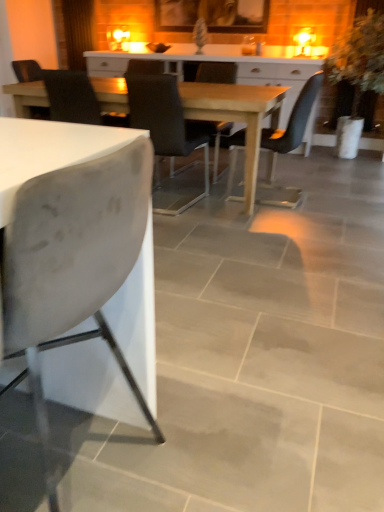
Question: Can you confirm if green leafy plant at right is thinner than white matte chair at left, which ranks as the 5th chair in back-to-front order?

Choices:
 (A) no
 (B) yes

Answer: (A)

Question: Is green leafy plant at right facing towards white matte chair at left, the first chair viewed from the front?

Choices:
 (A) yes
 (B) no

Answer: (A)

Question: From a real-world perspective, is green leafy plant at right located higher than white matte chair at left, which ranks as the 5th chair in back-to-front order?

Choices:
 (A) yes
 (B) no

Answer: (A)

Question: Is green leafy plant at right directly adjacent to white matte chair at left, the first chair viewed from the front?

Choices:
 (A) no
 (B) yes

Answer: (A)

Question: Does green leafy plant at right have a larger size compared to white matte chair at left, the first chair viewed from the front?

Choices:
 (A) no
 (B) yes

Answer: (B)

Question: Would you say wooden table at center is to the left or to the right of green leafy plant at right in the picture?

Choices:
 (A) left
 (B) right

Answer: (A)

Question: From a real-world perspective, is wooden table at center positioned above or below green leafy plant at right?

Choices:
 (A) below
 (B) above

Answer: (A)

Question: Is wooden table at center in front of or behind green leafy plant at right in the image?

Choices:
 (A) behind
 (B) front

Answer: (B)

Question: Is wooden table at center taller or shorter than green leafy plant at right?

Choices:
 (A) tall
 (B) short

Answer: (B)

Question: Is matte black chair at center, which is counted as the second chair, starting from the front, inside or outside of matte black chair at center, which is the 3th chair from back to front?

Choices:
 (A) outside
 (B) inside

Answer: (A)

Question: Is point (160, 192) closer or farther from the camera than point (274, 158)?

Choices:
 (A) farther
 (B) closer

Answer: (B)

Question: Considering the relative positions of matte black chair at center, arranged as the 4th chair when viewed from the back, and matte black chair at center, the third chair in the front-to-back sequence, in the image provided, is matte black chair at center, arranged as the 4th chair when viewed from the back, to the left or to the right of matte black chair at center, the third chair in the front-to-back sequence,?

Choices:
 (A) left
 (B) right

Answer: (A)

Question: Considering the positions of matte black chair at center, which is counted as the second chair, starting from the front, and matte black chair at center, the third chair in the front-to-back sequence, in the image, is matte black chair at center, which is counted as the second chair, starting from the front, taller or shorter than matte black chair at center, the third chair in the front-to-back sequence,?

Choices:
 (A) short
 (B) tall

Answer: (A)

Question: From the image's perspective, is matte black chair at center, which is the 3th chair from back to front, located above or below matte black chair at center, which ranks as the fifth chair in front-to-back order?

Choices:
 (A) above
 (B) below

Answer: (B)

Question: From a real-world perspective, is matte black chair at center, the third chair in the front-to-back sequence, physically located above or below matte black chair at center, which ranks as the fifth chair in front-to-back order?

Choices:
 (A) below
 (B) above

Answer: (B)